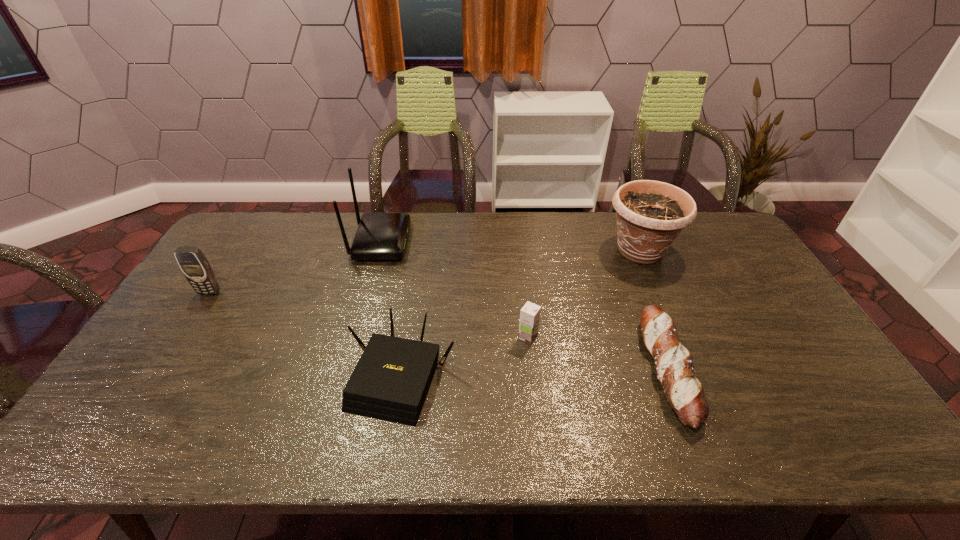
This screenshot has width=960, height=540. In order to click on vacant region that satisfies the following two spatial constraints: 1. on the front-facing side of the taller router; 2. on the left side of the flowerpot in this screenshot , I will do `click(378, 251)`.

This screenshot has height=540, width=960. I want to click on free spot that satisfies the following two spatial constraints: 1. on the front face of the fourth object from left to right; 2. on the right side of the leftmost object, so click(180, 337).

Locate an element on the screen. The height and width of the screenshot is (540, 960). free space that satisfies the following two spatial constraints: 1. on the front-facing side of the shorter router; 2. on the right side of the taller router is located at coordinates (344, 377).

Where is `vacant space that satisfies the following two spatial constraints: 1. on the front-facing side of the farther router; 2. on the right side of the shortest object`? Image resolution: width=960 pixels, height=540 pixels. vacant space that satisfies the following two spatial constraints: 1. on the front-facing side of the farther router; 2. on the right side of the shortest object is located at coordinates (346, 370).

Identify the location of free location that satisfies the following two spatial constraints: 1. on the front face of the fourth object from left to right; 2. on the right side of the fourth nearest object. The height and width of the screenshot is (540, 960). [180, 337].

Where is `vacant space that satisfies the following two spatial constraints: 1. on the front-facing side of the taller router; 2. on the right side of the baguet`? The width and height of the screenshot is (960, 540). vacant space that satisfies the following two spatial constraints: 1. on the front-facing side of the taller router; 2. on the right side of the baguet is located at coordinates (346, 370).

I want to click on vacant space that satisfies the following two spatial constraints: 1. on the back side of the shorter router; 2. on the front-facing side of the farther router, so click(x=423, y=241).